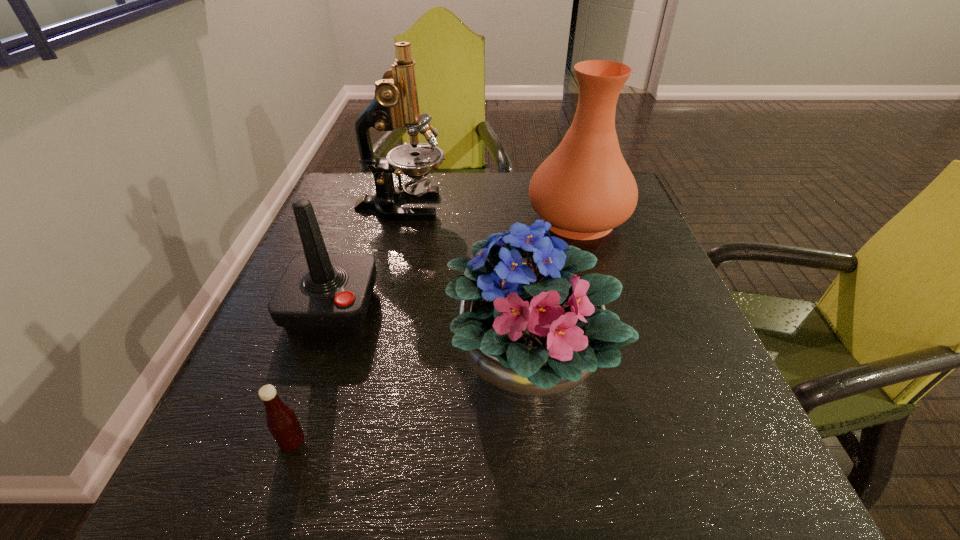
The width and height of the screenshot is (960, 540). I want to click on microscope that is at the far edge, so click(395, 103).

At what (x,y) coordinates should I click in order to perform the action: click on vase that is at the far edge. Please return your answer as a coordinate pair (x, y). This screenshot has height=540, width=960. Looking at the image, I should click on (584, 188).

Where is `microscope positioned at the left edge`? The height and width of the screenshot is (540, 960). microscope positioned at the left edge is located at coordinates (395, 103).

You are a GUI agent. You are given a task and a screenshot of the screen. Output one action in this format:
    pyautogui.click(x=<x>, y=<y>)
    Task: Click on the joystick that is at the left edge
    The height and width of the screenshot is (540, 960).
    Given the screenshot: What is the action you would take?
    pyautogui.click(x=319, y=292)

The height and width of the screenshot is (540, 960). In order to click on Tabasco sauce positioned at the left edge in this screenshot , I will do `click(282, 422)`.

Image resolution: width=960 pixels, height=540 pixels. I want to click on object present at the right edge, so click(584, 188).

At what (x,y) coordinates should I click in order to perform the action: click on object present at the far left corner. Please return your answer as a coordinate pair (x, y). Looking at the image, I should click on (395, 103).

Image resolution: width=960 pixels, height=540 pixels. I want to click on object that is at the far right corner, so click(x=584, y=188).

In the image, there is a desktop. Where is `vacant space at the far edge`? The height and width of the screenshot is (540, 960). vacant space at the far edge is located at coordinates (403, 180).

The height and width of the screenshot is (540, 960). Identify the location of vacant space at the near edge of the desktop. (378, 490).